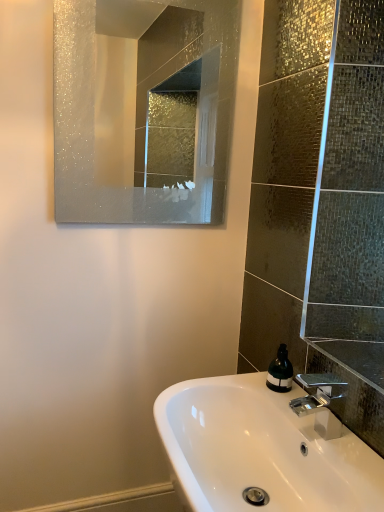
Measure the distance between point (270, 411) and camera.

Point (270, 411) is 1.17 meters away from camera.

The width and height of the screenshot is (384, 512). I want to click on green matte soap dispenser at lower right, so click(280, 371).

What do you see at coordinates (142, 109) in the screenshot? I see `frosted glass mirror at upper center` at bounding box center [142, 109].

Locate an element on the screen. frosted glass mirror at upper center is located at coordinates (142, 109).

Locate an element on the screen. polished chrome faucet at lower right is located at coordinates (322, 402).

From the image's perspective, who appears lower, green matte soap dispenser at lower right or frosted glass mirror at upper center?

green matte soap dispenser at lower right appears lower in the image.

Is point (271, 365) positioned behind point (134, 45)?

No, it is in front of (134, 45).

Which object is further away from the camera, green matte soap dispenser at lower right or frosted glass mirror at upper center?

frosted glass mirror at upper center is further from the camera.

Does green matte soap dispenser at lower right have a lesser width compared to frosted glass mirror at upper center?

No.

Can you tell me how much white glossy sink at lower center and polished chrome faucet at lower right differ in facing direction?

The facing directions of white glossy sink at lower center and polished chrome faucet at lower right are 0.00128 degrees apart.

Measure the distance from white glossy sink at lower center to polished chrome faucet at lower right.

A distance of 6.48 inches exists between white glossy sink at lower center and polished chrome faucet at lower right.

From the image's perspective, which is above, white glossy sink at lower center or polished chrome faucet at lower right?

polished chrome faucet at lower right, from the image's perspective.

Can you confirm if white glossy sink at lower center is taller than polished chrome faucet at lower right?

Yes.

Can you confirm if polished chrome faucet at lower right is shorter than white glossy sink at lower center?

Yes.

This screenshot has height=512, width=384. I want to click on tap that is behind the white glossy sink at lower center, so click(x=322, y=402).

Does polished chrome faucet at lower right have a smaller size compared to white glossy sink at lower center?

Yes, polished chrome faucet at lower right is smaller than white glossy sink at lower center.

Can you tell me how much polished chrome faucet at lower right and white glossy sink at lower center differ in facing direction?

0.00128 degrees.

Between white glossy sink at lower center and frosted glass mirror at upper center, which one is positioned in front?

Positioned in front is white glossy sink at lower center.

In terms of height, does white glossy sink at lower center look taller or shorter compared to frosted glass mirror at upper center?

Considering their sizes, white glossy sink at lower center has less height than frosted glass mirror at upper center.

From the picture: Who is smaller, white glossy sink at lower center or frosted glass mirror at upper center?

Smaller between the two is frosted glass mirror at upper center.

From the image's perspective, which is above, white glossy sink at lower center or frosted glass mirror at upper center?

frosted glass mirror at upper center, from the image's perspective.

Could you tell me if frosted glass mirror at upper center is turned towards green matte soap dispenser at lower right?

No, frosted glass mirror at upper center is not aimed at green matte soap dispenser at lower right.

Considering the positions of objects frosted glass mirror at upper center and green matte soap dispenser at lower right in the image provided, who is more to the right, frosted glass mirror at upper center or green matte soap dispenser at lower right?

green matte soap dispenser at lower right is more to the right.

Based on the photo, can you see frosted glass mirror at upper center touching green matte soap dispenser at lower right?

No, frosted glass mirror at upper center is not touching green matte soap dispenser at lower right.

Does frosted glass mirror at upper center have a lesser width compared to green matte soap dispenser at lower right?

Correct, the width of frosted glass mirror at upper center is less than that of green matte soap dispenser at lower right.

From the image's perspective, does frosted glass mirror at upper center appear higher than white glossy sink at lower center?

Correct, frosted glass mirror at upper center appears higher than white glossy sink at lower center in the image.

Is frosted glass mirror at upper center not close to white glossy sink at lower center?

Absolutely, frosted glass mirror at upper center is distant from white glossy sink at lower center.

The width and height of the screenshot is (384, 512). What are the coordinates of `sink in front of the frosted glass mirror at upper center` in the screenshot? It's located at (260, 450).

From the image's perspective, is green matte soap dispenser at lower right below white glossy sink at lower center?

No, from the image's perspective, green matte soap dispenser at lower right is not below white glossy sink at lower center.

How different are the orientations of green matte soap dispenser at lower right and white glossy sink at lower center in degrees?

3.4 degrees.

Considering the positions of objects green matte soap dispenser at lower right and white glossy sink at lower center in the image provided, who is behind, green matte soap dispenser at lower right or white glossy sink at lower center?

green matte soap dispenser at lower right.

Considering the relative sizes of green matte soap dispenser at lower right and white glossy sink at lower center in the image provided, is green matte soap dispenser at lower right bigger than white glossy sink at lower center?

Actually, green matte soap dispenser at lower right might be smaller than white glossy sink at lower center.

Find the location of a particular element. mirror that appears above the green matte soap dispenser at lower right (from the image's perspective) is located at coordinates (142, 109).

You are a GUI agent. You are given a task and a screenshot of the screen. Output one action in this format:
    pyautogui.click(x=<x>, y=<y>)
    Task: Click on the sink that appears in front of the polished chrome faucet at lower right
    
    Given the screenshot: What is the action you would take?
    pyautogui.click(x=260, y=450)

From the picture: Looking at the image, which one is located further to green matte soap dispenser at lower right, frosted glass mirror at upper center or white glossy sink at lower center?

frosted glass mirror at upper center.

When comparing their distances from polished chrome faucet at lower right, does frosted glass mirror at upper center or green matte soap dispenser at lower right seem further?

frosted glass mirror at upper center.

Based on their spatial positions, is polished chrome faucet at lower right or white glossy sink at lower center further from frosted glass mirror at upper center?

polished chrome faucet at lower right is further to frosted glass mirror at upper center.

Which object lies further to the anchor point frosted glass mirror at upper center, green matte soap dispenser at lower right or white glossy sink at lower center?

green matte soap dispenser at lower right.

Which object lies nearer to the anchor point polished chrome faucet at lower right, white glossy sink at lower center or green matte soap dispenser at lower right?

Based on the image, green matte soap dispenser at lower right appears to be nearer to polished chrome faucet at lower right.

When comparing their distances from green matte soap dispenser at lower right, does polished chrome faucet at lower right or frosted glass mirror at upper center seem further?

Among the two, frosted glass mirror at upper center is located further to green matte soap dispenser at lower right.

Looking at the image, which one is located further to green matte soap dispenser at lower right, frosted glass mirror at upper center or polished chrome faucet at lower right?

Among the two, frosted glass mirror at upper center is located further to green matte soap dispenser at lower right.

When comparing their distances from green matte soap dispenser at lower right, does polished chrome faucet at lower right or white glossy sink at lower center seem further?

Based on the image, white glossy sink at lower center appears to be further to green matte soap dispenser at lower right.

This screenshot has height=512, width=384. In order to click on tap between frosted glass mirror at upper center and white glossy sink at lower center in the up-down direction in this screenshot , I will do `click(322, 402)`.

At what (x,y) coordinates should I click in order to perform the action: click on tap between white glossy sink at lower center and green matte soap dispenser at lower right in the front-back direction. Please return your answer as a coordinate pair (x, y). The height and width of the screenshot is (512, 384). Looking at the image, I should click on (322, 402).

Find the location of a particular element. soap dispenser between frosted glass mirror at upper center and white glossy sink at lower center in the up-down direction is located at coordinates (280, 371).

Find the location of a particular element. soap dispenser between frosted glass mirror at upper center and polished chrome faucet at lower right from top to bottom is located at coordinates (280, 371).